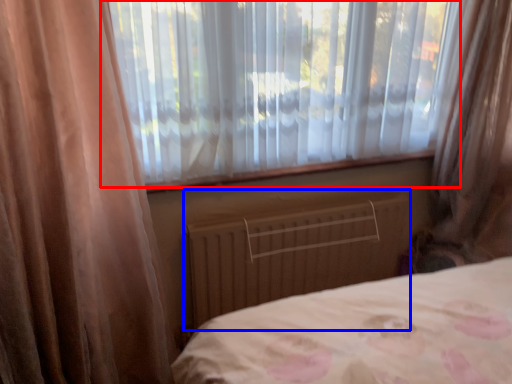
Question: Among these objects, which one is nearest to the camera, window (highlighted by a red box) or radiator (highlighted by a blue box)?

Choices:
 (A) window
 (B) radiator

Answer: (A)